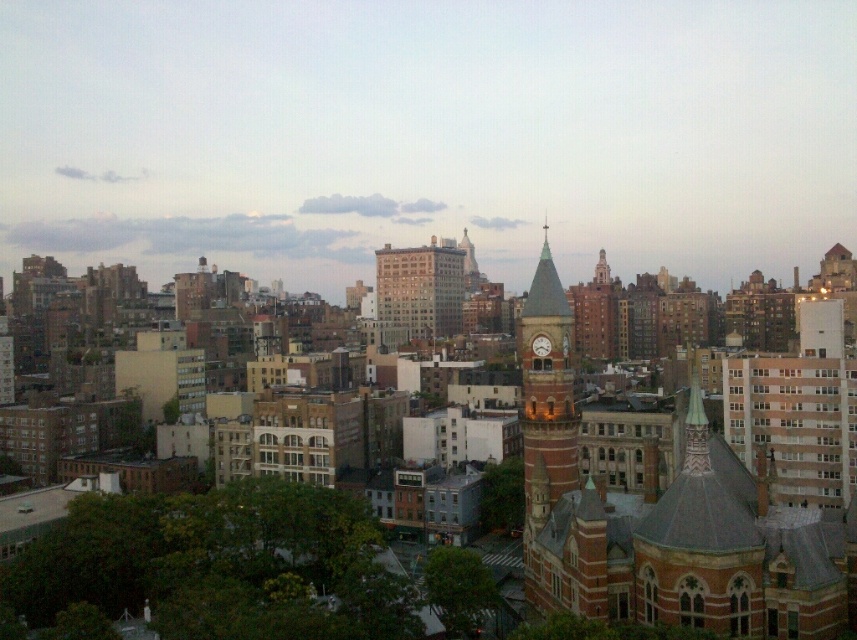
You are standing at the rooftop adjacent to the trees in the lower left corner of the image. You want to take a photo of the green copper dome at center. In which direction should you point your camera to capture it?

The green copper dome at center is located at point (700,541), which is towards the upper right direction from your current position at the rooftop adjacent to the trees in the lower left corner. Point your camera towards the upper right to capture it.

You are an architect analyzing the urban skyline. You notice the green copper dome at center and the matte brick clock tower at center. Which of these two structures is positioned lower in the image?

The green copper dome at center is positioned lower than the matte brick clock tower at center in the image.

You are an architect evaluating the urban layout. Given the green copper dome at center and the matte brick clock tower at center, which structure has a greater horizontal span?

The green copper dome at center has a greater horizontal span than the matte brick clock tower at center, as its width surpasses the clock tower.